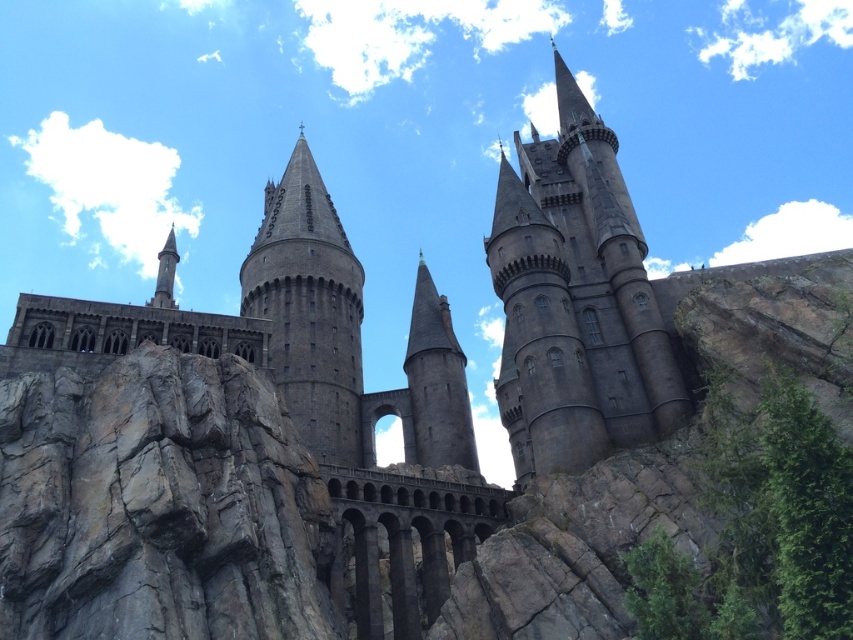
Is dark stone tower at center wider than smooth gray stone tower at center?

Yes, dark stone tower at center is wider than smooth gray stone tower at center.

How far apart are dark stone tower at center and smooth gray stone tower at center?

dark stone tower at center and smooth gray stone tower at center are 16.89 meters apart.

Identify the location of dark stone tower at center. The height and width of the screenshot is (640, 853). (575, 301).

The image size is (853, 640). I want to click on dark stone tower at center, so click(x=575, y=301).

The height and width of the screenshot is (640, 853). Describe the element at coordinates (309, 308) in the screenshot. I see `dark gray stone tower at center` at that location.

Between dark gray stone tower at center and smooth gray stone tower at center, which one is positioned higher?

dark gray stone tower at center is higher up.

The height and width of the screenshot is (640, 853). I want to click on dark gray stone tower at center, so click(309, 308).

Does dark stone tower at center have a greater height compared to dark gray stone tower at center?

Correct, dark stone tower at center is much taller as dark gray stone tower at center.

Is point (532, 333) farther from camera compared to point (347, 243)?

No, (532, 333) is closer to viewer.

This screenshot has height=640, width=853. Find the location of `dark stone tower at center`. dark stone tower at center is located at coordinates (575, 301).